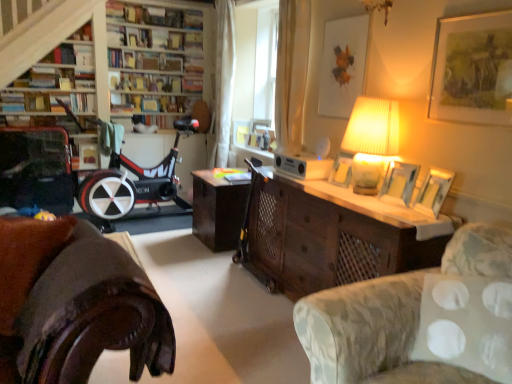
You are a GUI agent. You are given a task and a screenshot of the screen. Output one action in this format:
    pyautogui.click(x=<x>, y=<y>)
    Task: Click on the vacant space situated above hardcover book at upper left, which ranks as the second book in front-to-back order (from a real-world perspective)
    The width and height of the screenshot is (512, 384).
    Given the screenshot: What is the action you would take?
    pyautogui.click(x=71, y=92)